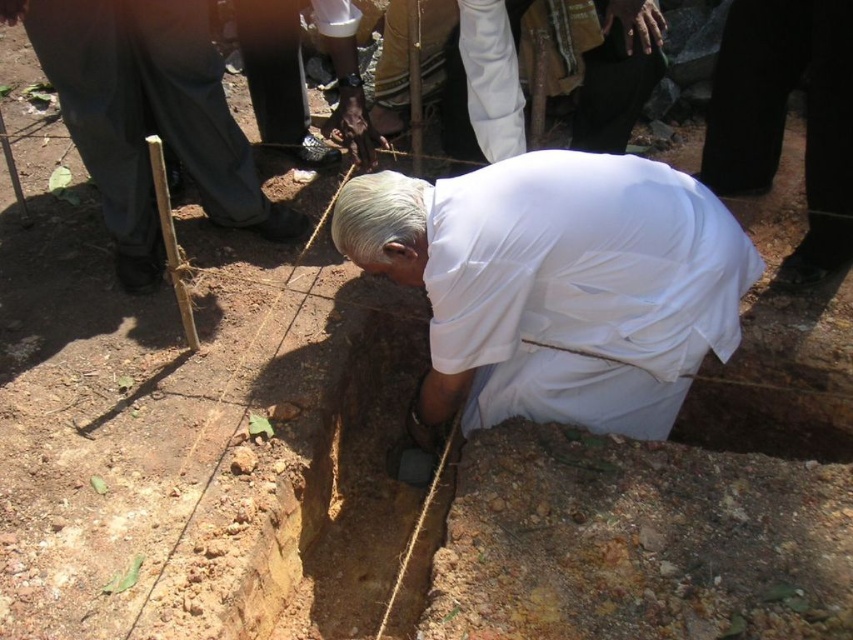
Does point (430, 216) come closer to viewer compared to point (836, 83)?

Yes, point (430, 216) is closer to viewer.

Based on the photo, who is lower down, white cloth at center or white cloth at lower right?

white cloth at center is below.

Which is behind, point (502, 324) or point (802, 32)?

The point (802, 32) is behind.

What are the coordinates of `white cloth at center` in the screenshot? It's located at (581, 289).

Between smooth wooden stick at lower left and white cloth at lower right, which one has more height?

With more height is white cloth at lower right.

Is smooth wooden stick at lower left above white cloth at lower right?

No, smooth wooden stick at lower left is not above white cloth at lower right.

Which is in front, point (56, 61) or point (730, 77)?

Point (56, 61) is more forward.

Where is `smooth wooden stick at lower left`? smooth wooden stick at lower left is located at coordinates (148, 116).

Is point (654, 388) positioned after point (206, 484)?

Yes.

Between white cloth at center and brown dirt crack at lower center, which one appears on the left side from the viewer's perspective?

brown dirt crack at lower center is more to the left.

Between point (437, 264) and point (316, 225), which one is positioned in front?

Point (437, 264) is in front.

Where is `white cloth at center`? The height and width of the screenshot is (640, 853). white cloth at center is located at coordinates (581, 289).